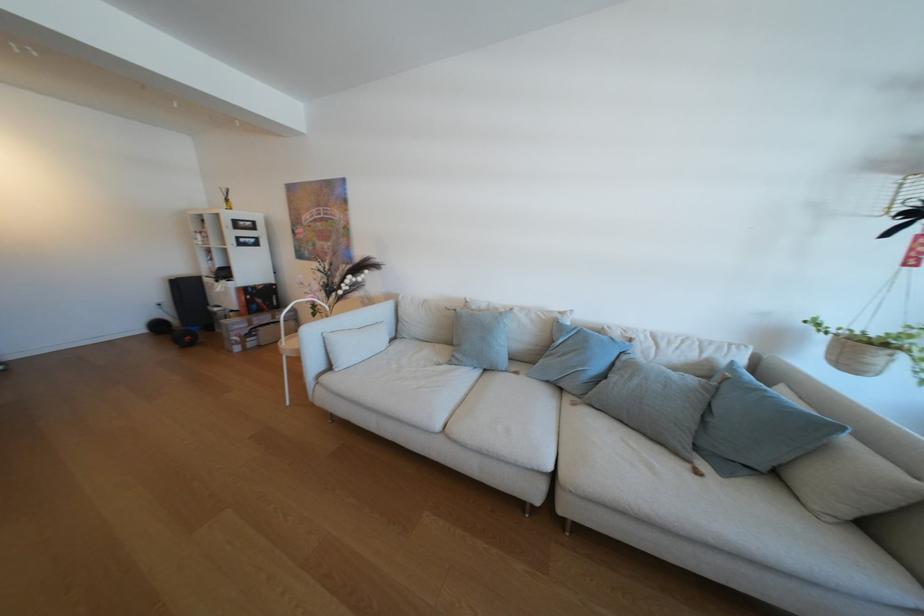
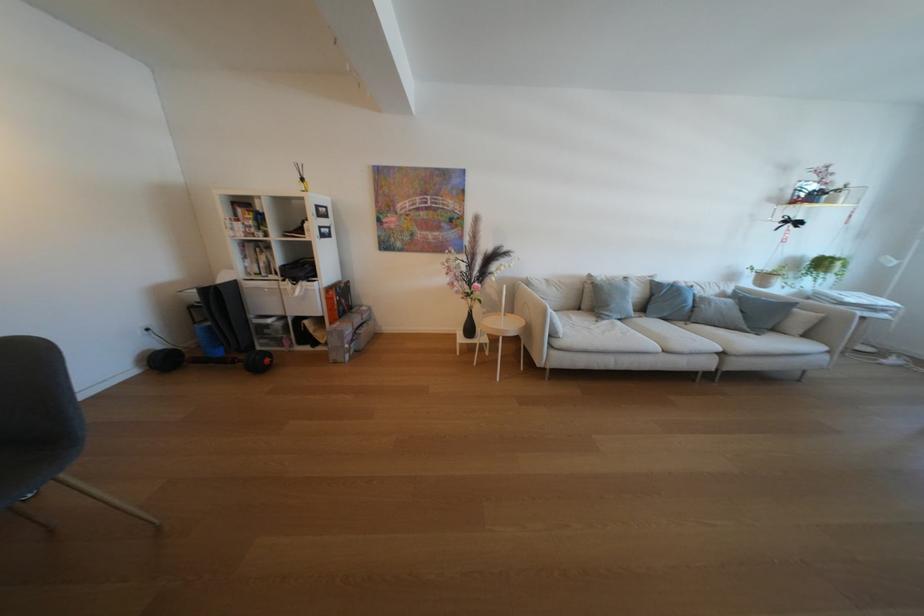
Locate, in the second image, the point that corresponds to point (347, 371) in the first image.

(572, 338)